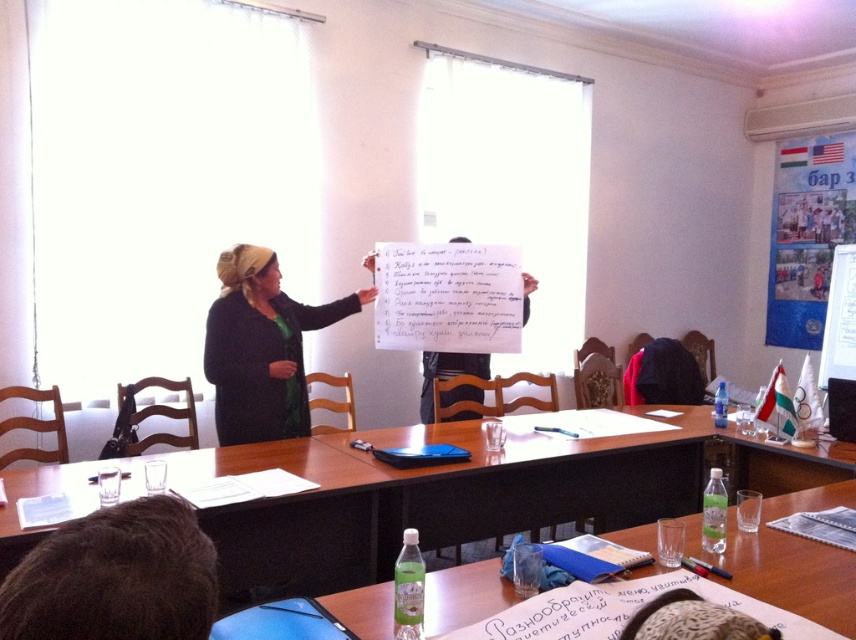
You are standing at the camera position and want to place a 5 feet long banner on the floor between you and the brown wooden table at center. Can the banner fit without overlapping the table?

The distance between you and the brown wooden table at center is 6.01 feet, which is greater than the banner length of 5 feet. Therefore, the banner can fit without overlapping the table.

You are attending a meeting in the room and want to place a small notebook on the wooden table at center. However, you notice the dark green fabric headscarf at center is currently on the table. Can you place the notebook there without moving the headscarf?

The wooden table at center is below dark green fabric headscarf at center, meaning the headscarf is not on the table but above it. Therefore, you can safely place the notebook on the wooden table at center without moving the headscarf.

Consider the image. You are sitting at the brown wooden table at center in the meeting room. There is a point marked at coordinates (300,518). Is this point located on the table?

Yes, the point (300,518) is on the brown wooden table at center according to the description.